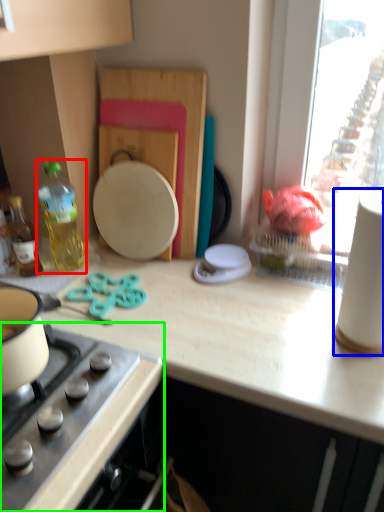
Question: Estimate the real-world distances between objects in this image. Which object is closer to bottle (highlighted by a red box), paper towel (highlighted by a blue box) or gas stove (highlighted by a green box)?

Choices:
 (A) paper towel
 (B) gas stove

Answer: (B)